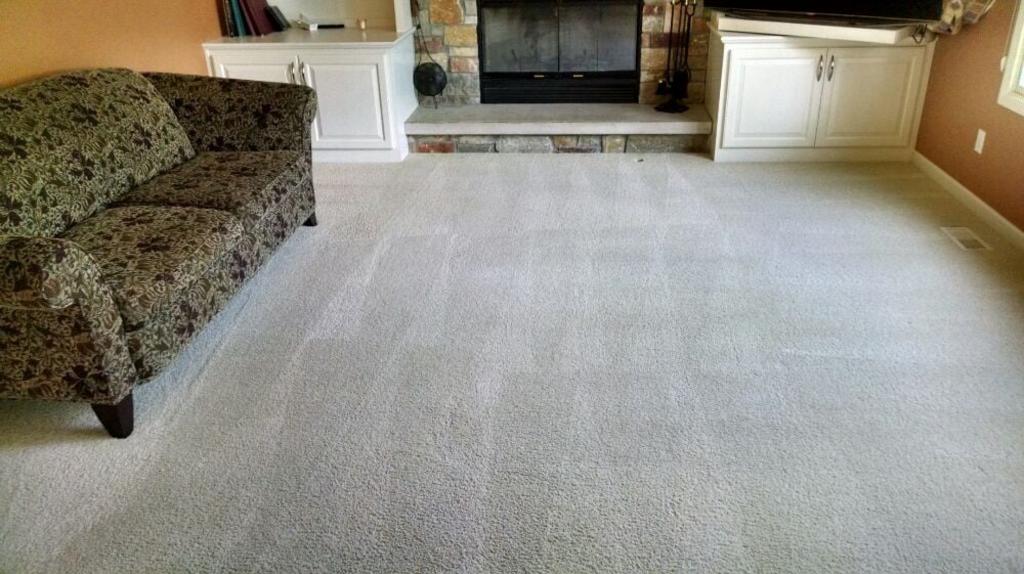
Where is `drawer`? The width and height of the screenshot is (1024, 574). drawer is located at coordinates (784, 100).